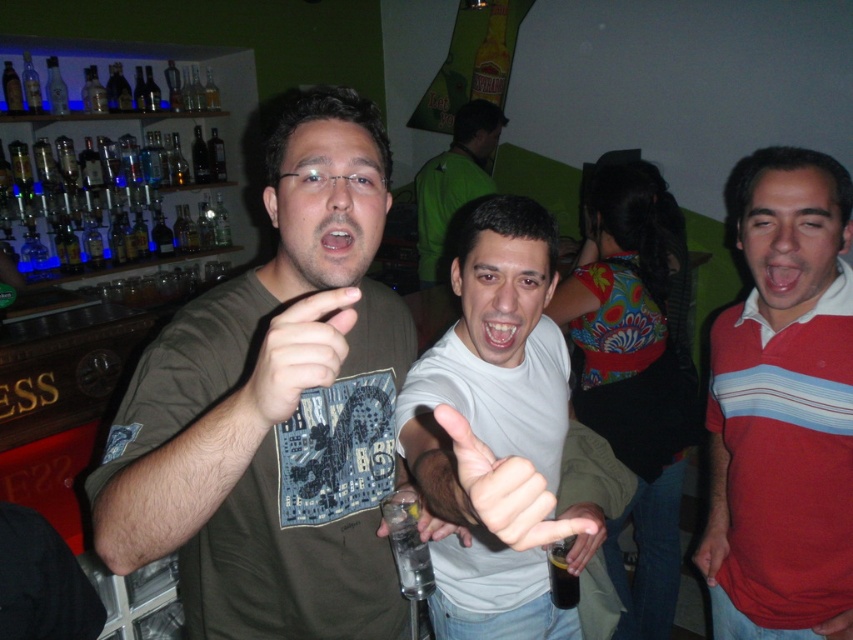
You are a bartender preparing to serve a drink to the people in the image. You have a clear plastic glass at center and a matte green shirt at center. Which of these two items is taller?

The matte green shirt at center is much taller than the clear plastic glass at center.